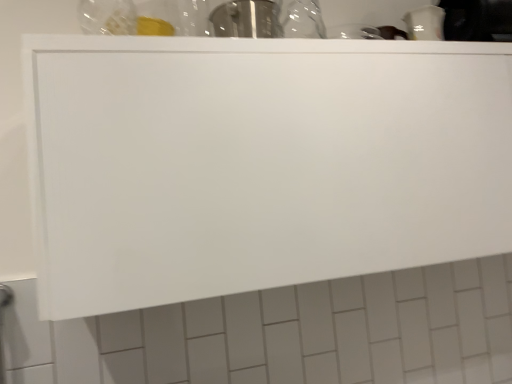
What do you see at coordinates (258, 163) in the screenshot? Image resolution: width=512 pixels, height=384 pixels. I see `white matte cabinet at upper center` at bounding box center [258, 163].

I want to click on white matte cabinet at upper center, so click(258, 163).

Find the location of a particular element. This screenshot has height=384, width=512. white matte cabinet at upper center is located at coordinates (258, 163).